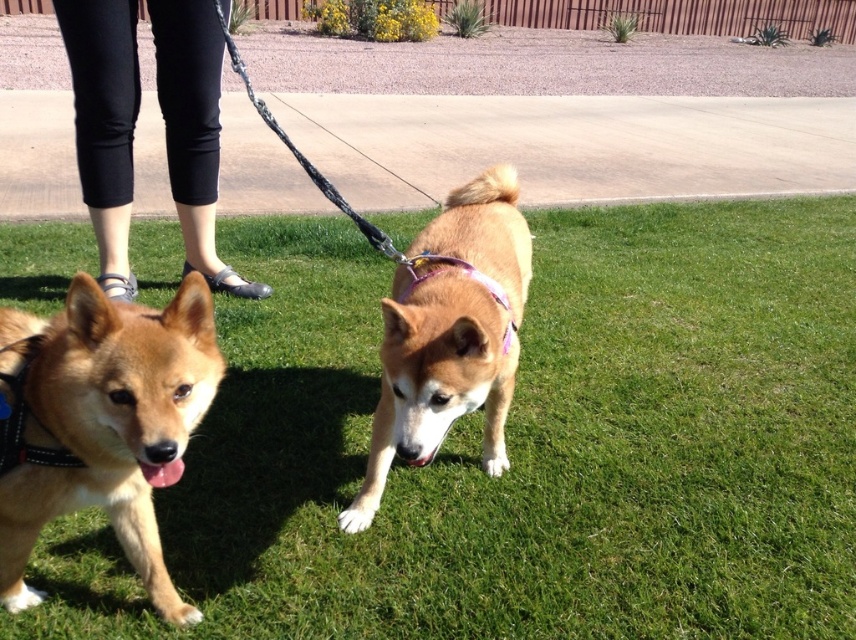
Looking at this image, you are a photographer setting up a shot of the two dogs in the scene. You want to ensure the green grass at center and the black fabric pants at upper left are both in focus. Which object should you focus on first to ensure both are sharp?

The green grass at center is much taller than the black fabric pants at upper left, so focusing on the green grass at center first would ensure both are in focus since it is farther away.

You are taking a photo of two points in the scene. The first point is at coordinate point [565,474] and the second point is at point [87,65]. Which point will appear larger in your photo?

Point [565,474] is closer to the camera than point [87,65], so it will appear larger in the photo.